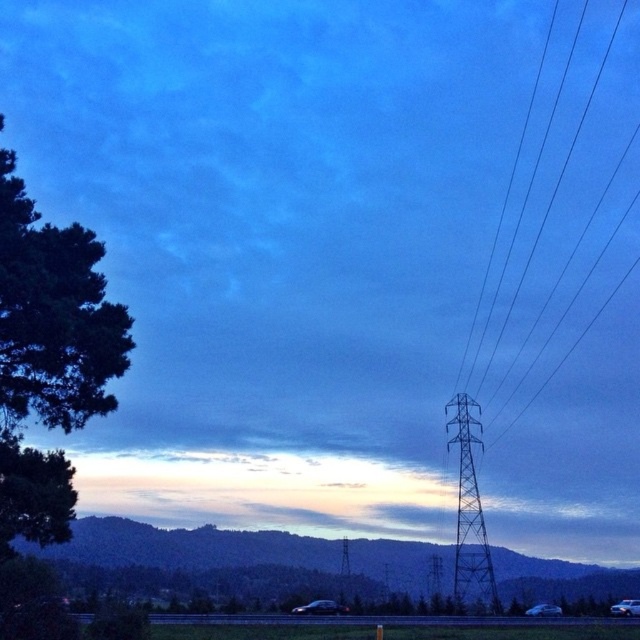
Question: Is the position of green leafy tree at left more distant than that of metallic gray telegraph pole at center-right?

Choices:
 (A) no
 (B) yes

Answer: (A)

Question: Which of these objects is positioned farthest from the metallic gray telegraph pole at center-right?

Choices:
 (A) green leafy tree at left
 (B) black wire at right

Answer: (A)

Question: Estimate the real-world distances between objects in this image. Which object is closer to the metallic gray telegraph pole at center-right?

Choices:
 (A) green leafy tree at left
 (B) black wire at right

Answer: (B)

Question: Which object is closer to the camera taking this photo?

Choices:
 (A) green leafy tree at left
 (B) black wire at right

Answer: (A)

Question: Does metallic gray telegraph pole at center-right appear on the left side of black wire at right?

Choices:
 (A) yes
 (B) no

Answer: (A)

Question: Can you confirm if green leafy tree at left is smaller than black wire at right?

Choices:
 (A) no
 (B) yes

Answer: (B)